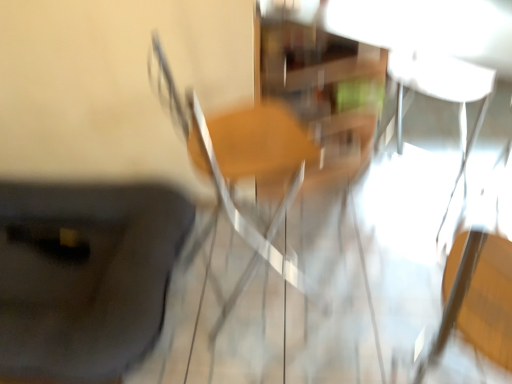
Question: Should I look upward or downward to see black matte suitcase at lower left?

Choices:
 (A) up
 (B) down

Answer: (B)

Question: Considering the relative sizes of black matte suitcase at lower left and wooden chair at center in the image provided, is black matte suitcase at lower left thinner than wooden chair at center?

Choices:
 (A) yes
 (B) no

Answer: (B)

Question: From the image's perspective, is black matte suitcase at lower left above wooden chair at center?

Choices:
 (A) no
 (B) yes

Answer: (A)

Question: Can you confirm if black matte suitcase at lower left is positioned to the left of wooden chair at center?

Choices:
 (A) no
 (B) yes

Answer: (B)

Question: From the image's perspective, is black matte suitcase at lower left beneath wooden chair at center?

Choices:
 (A) no
 (B) yes

Answer: (B)

Question: Does black matte suitcase at lower left have a smaller size compared to wooden chair at center?

Choices:
 (A) yes
 (B) no

Answer: (B)

Question: Is the surface of black matte suitcase at lower left in direct contact with wooden chair at center?

Choices:
 (A) no
 (B) yes

Answer: (A)

Question: Would you consider wooden chair at center to be distant from black matte suitcase at lower left?

Choices:
 (A) no
 (B) yes

Answer: (A)

Question: Does wooden chair at center have a lesser width compared to black matte suitcase at lower left?

Choices:
 (A) yes
 (B) no

Answer: (A)

Question: Can you confirm if wooden chair at center is shorter than black matte suitcase at lower left?

Choices:
 (A) yes
 (B) no

Answer: (B)

Question: Is black matte suitcase at lower left completely or partially inside wooden chair at center?

Choices:
 (A) yes
 (B) no

Answer: (B)

Question: Does wooden chair at center appear on the right side of black matte suitcase at lower left?

Choices:
 (A) no
 (B) yes

Answer: (B)

Question: Could you tell me if wooden chair at center is facing black matte suitcase at lower left?

Choices:
 (A) yes
 (B) no

Answer: (B)

Question: From the image's perspective, relative to wooden chair at center, is black matte suitcase at lower left above or below?

Choices:
 (A) below
 (B) above

Answer: (A)